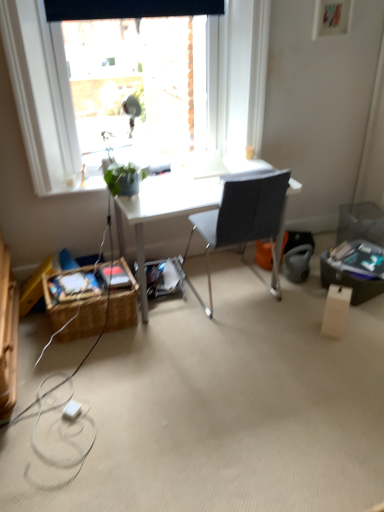
Question: Is gray fabric chair at center wider or thinner than transparent glass window at upper center?

Choices:
 (A) thin
 (B) wide

Answer: (B)

Question: Does point (279, 292) appear closer or farther from the camera than point (253, 27)?

Choices:
 (A) closer
 (B) farther

Answer: (B)

Question: Which object is positioned farthest from the transparent glass window at upper center?

Choices:
 (A) green matte plant at upper left
 (B) white plastic power outlet at lower left
 (C) wooden picture frame at upper right
 (D) gray fabric chair at center
 (E) woven brown picnic basket at lower left

Answer: (B)

Question: Considering the real-world distances, which object is farthest from the gray fabric chair at center?

Choices:
 (A) white cardboard box at lower right
 (B) woven brown picnic basket at lower left
 (C) white plastic power outlet at lower left
 (D) wooden picture frame at upper right
 (E) green matte plant at upper left

Answer: (C)